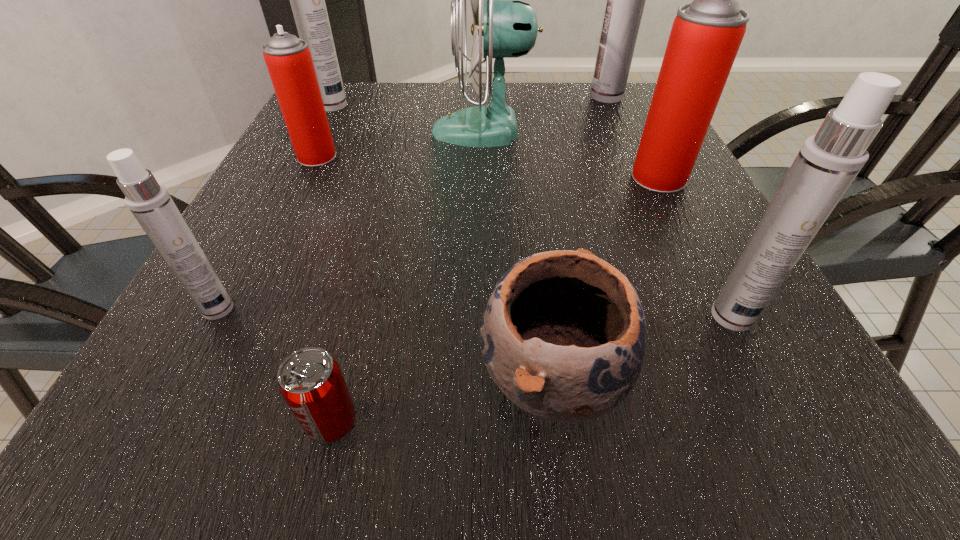
At what (x,y) coordinates should I click in order to perform the action: click on soda can. Please return your answer as a coordinate pair (x, y). Looking at the image, I should click on (311, 382).

The height and width of the screenshot is (540, 960). In order to click on the shortest object in this screenshot , I will do `click(311, 382)`.

The image size is (960, 540). Identify the location of vacant space located 0.250m on the front of the tallest aerosol can. (632, 153).

You are a GUI agent. You are given a task and a screenshot of the screen. Output one action in this format:
    pyautogui.click(x=<x>, y=<y>)
    Task: Click on the vacant space situated 0.360m on the right of the second tallest aerosol can
    
    Given the screenshot: What is the action you would take?
    pyautogui.click(x=483, y=106)

Find the location of `vacant space located in front of the teal fan, directing airflow`. vacant space located in front of the teal fan, directing airflow is located at coordinates pyautogui.click(x=300, y=131).

Where is `vacant space located 0.310m in front of the teal fan, directing airflow`? The image size is (960, 540). vacant space located 0.310m in front of the teal fan, directing airflow is located at coordinates (304, 131).

Locate an element on the screen. The height and width of the screenshot is (540, 960). vacant space positioned in front of the teal fan, directing airflow is located at coordinates (304, 131).

Where is `vacant space located on the left of the bigger red aerosol can`? This screenshot has height=540, width=960. vacant space located on the left of the bigger red aerosol can is located at coordinates (552, 178).

Where is `vacant space positioned on the back of the third biggest white aerosol can`? This screenshot has width=960, height=540. vacant space positioned on the back of the third biggest white aerosol can is located at coordinates (662, 179).

Identify the location of vacant space located on the front of the left red aerosol can. This screenshot has width=960, height=540. 246,302.